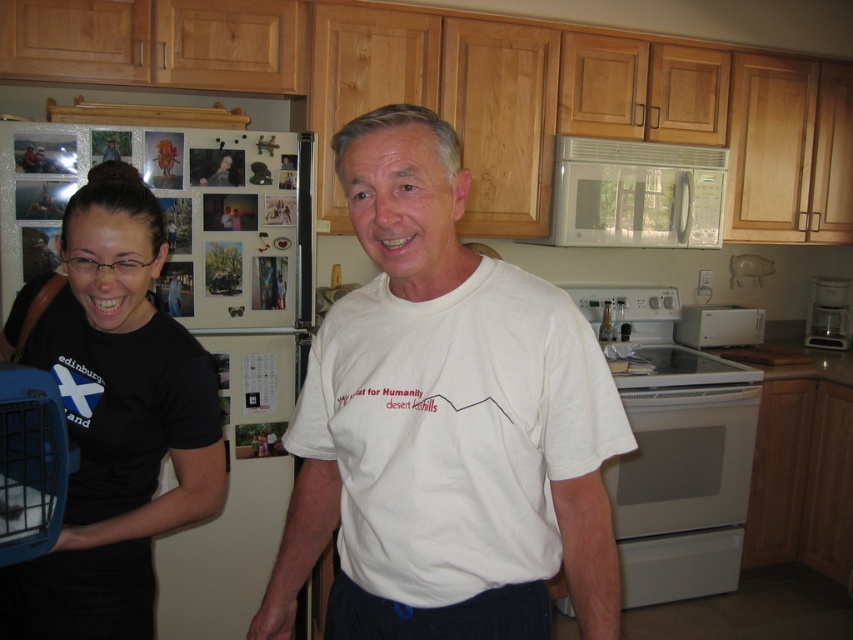
Can you confirm if white cotton t-shirt at center is positioned above metallic silver coffee maker at right?

Incorrect, white cotton t-shirt at center is not positioned above metallic silver coffee maker at right.

Which is more to the right, white cotton t-shirt at center or metallic silver coffee maker at right?

metallic silver coffee maker at right

Is point (490, 376) closer to camera compared to point (817, 342)?

Yes.

The image size is (853, 640). I want to click on white cotton t-shirt at center, so click(x=444, y=422).

The image size is (853, 640). Identify the location of white glossy electric stove at center. (677, 456).

Who is lower down, white glossy electric stove at center or white glossy microwave at upper center?

white glossy electric stove at center is below.

At what (x,y) coordinates should I click in order to perform the action: click on white glossy electric stove at center. Please return your answer as a coordinate pair (x, y). Looking at the image, I should click on (677, 456).

Where is `white glossy electric stove at center`? This screenshot has height=640, width=853. white glossy electric stove at center is located at coordinates (677, 456).

Is white cotton t-shirt at center further to the viewer compared to black matte shirt at left?

No, white cotton t-shirt at center is in front of black matte shirt at left.

Between point (457, 529) and point (76, 195), which one is positioned in front?

Point (457, 529) is in front.

Between point (612, 454) and point (106, 458), which one is positioned behind?

The point (106, 458) is behind.

Identify the location of white cotton t-shirt at center. (444, 422).